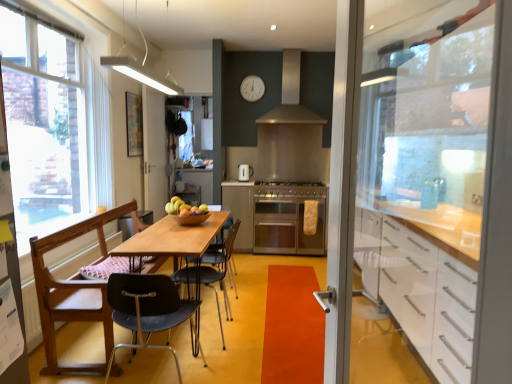
You are a GUI agent. You are given a task and a screenshot of the screen. Output one action in this format:
    pyautogui.click(x=<x>, y=<y>)
    Task: Click on the vacant space to the right of wooden table at center
    The width and height of the screenshot is (512, 384).
    Given the screenshot: What is the action you would take?
    pyautogui.click(x=275, y=318)